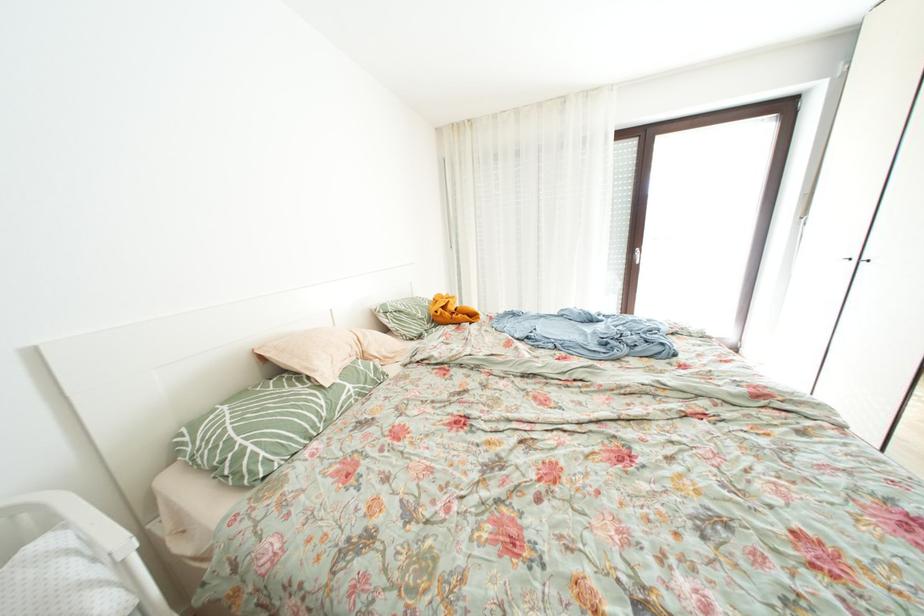
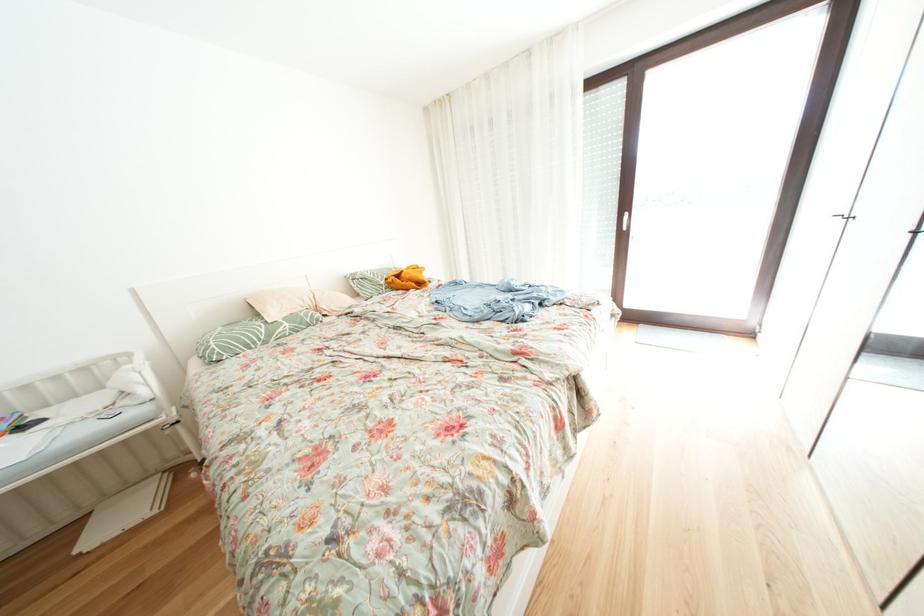
Question: Which direction would the cameraman need to move to produce the second image? Reply with the corresponding letter.

Choices:
 (A) Left
 (B) Right
 (C) Forward
 (D) Backward

Answer: (B)